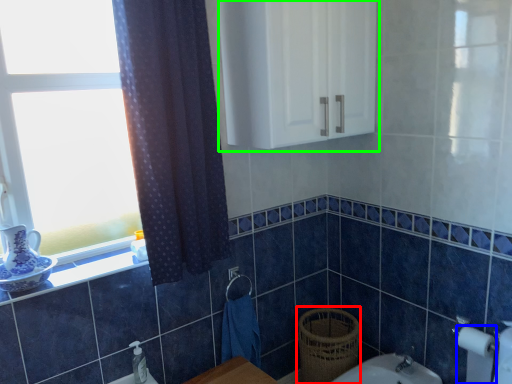
Question: Considering the real-world distances, which object is closest to basket (highlighted by a red box)? toilet paper (highlighted by a blue box) or medicine cabinet (highlighted by a green box).

Choices:
 (A) toilet paper
 (B) medicine cabinet

Answer: (A)